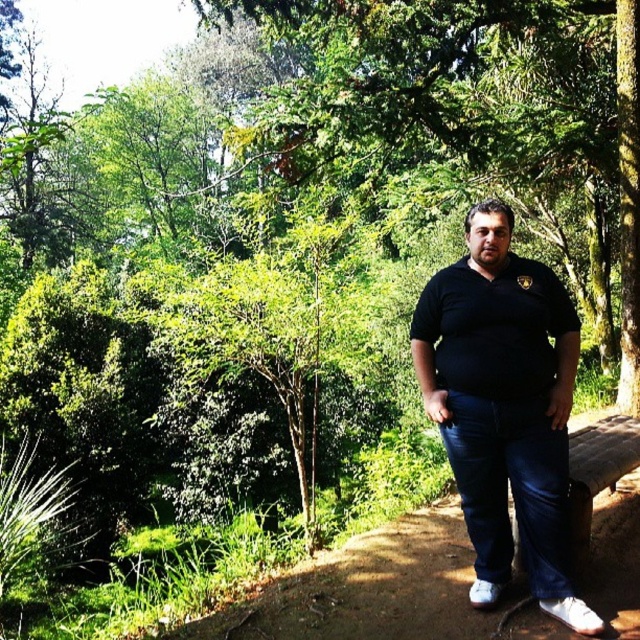
You are a fashion designer observing a person wearing two tops, a black matte shirt at center and a black matte polo shirt at center. Which top is larger in size?

The black matte shirt at center is bigger than the black matte polo shirt at center.

From the picture: You are a fashion designer observing a person wearing two black matte shirts. The person has a black matte shirt at center and a black matte polo shirt at center. Which one is on the right side?

The black matte shirt at center is positioned on the right side of the black matte polo shirt at center.